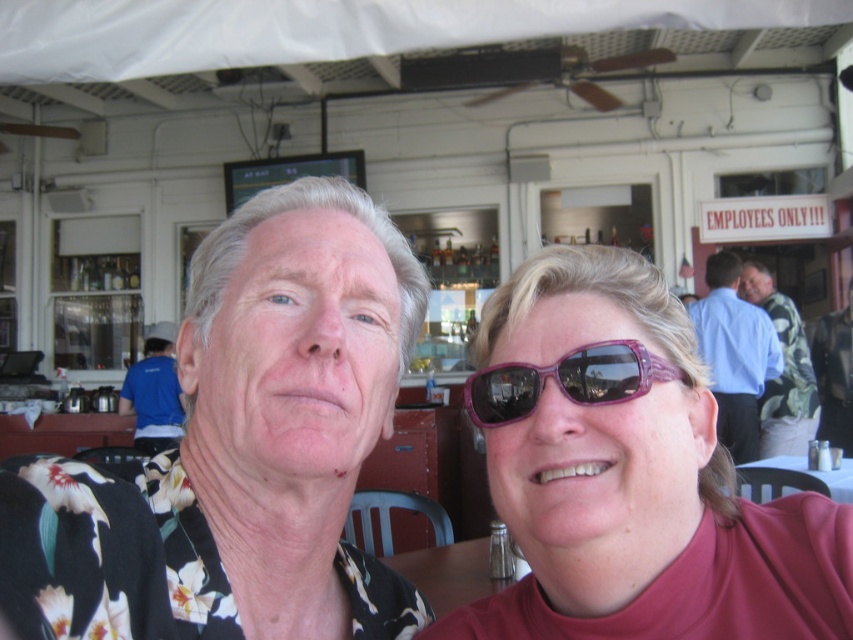
You are a waiter at the bar and need to place a drink order form on the white plastic table at lower center. Where should you place it so that it doesn not block the view of the purple glossy sunglasses at center?

The purple glossy sunglasses at center is in front of the white plastic table at lower center, so placing the drink order form behind the sunglasses would ensure it doesn not block the view of the sunglasses.

You are a photographer standing at the bar counter. You want to take a photo of the purple shiny sunglasses at center while keeping the camera close to the bar counter. Can you do this without moving the sunglasses?

The purple shiny sunglasses at center and camera are 24.26 inches apart from each other. Since the camera is close to the bar counter, the distance between them allows the photographer to take the photo without moving the sunglasses.